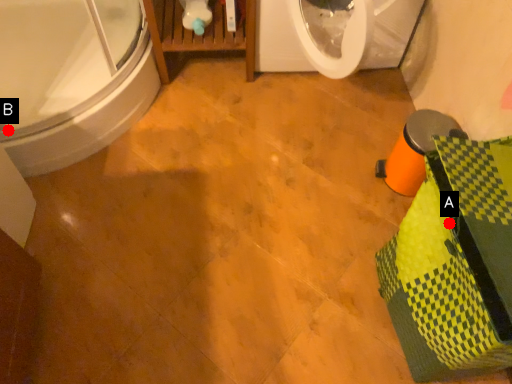
Question: Two points are circled on the image, labeled by A and B beside each circle. Which of the following is the farthest from the observer?

Choices:
 (A) A is further
 (B) B is further

Answer: (B)